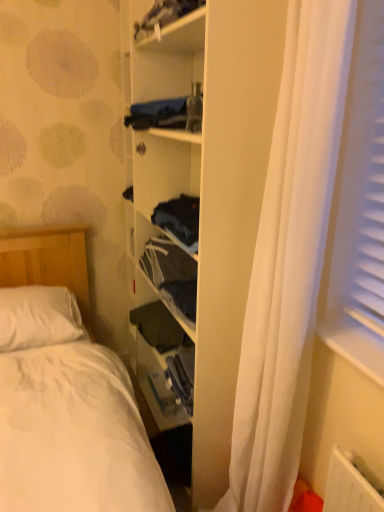
Question: From a real-world perspective, relative to wooden bookshelf at center, is white soft pillow at left vertically above or below?

Choices:
 (A) above
 (B) below

Answer: (B)

Question: Relative to wooden bookshelf at center, is white soft pillow at left in front or behind?

Choices:
 (A) front
 (B) behind

Answer: (B)

Question: Estimate the real-world distances between objects in this image. Which object is farther from the white soft pillow at left?

Choices:
 (A) dark blue fabric at upper center
 (B) wooden bookshelf at center
 (C) white fabric curtain at center

Answer: (A)

Question: Which object is the closest to the dark blue fabric at upper center?

Choices:
 (A) white fabric curtain at center
 (B) wooden bookshelf at center
 (C) white soft pillow at left

Answer: (B)